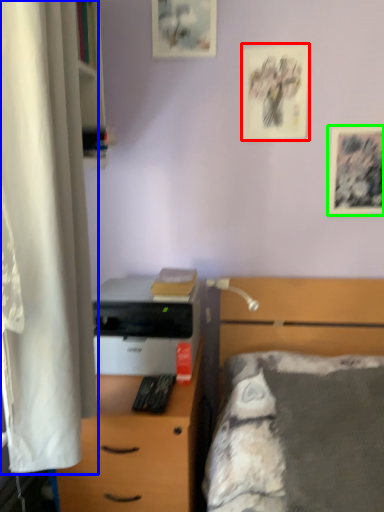
Question: Estimate the real-world distances between objects in this image. Which object is closer to picture frame (highlighted by a red box), curtain (highlighted by a blue box) or picture frame (highlighted by a green box)?

Choices:
 (A) curtain
 (B) picture frame

Answer: (B)